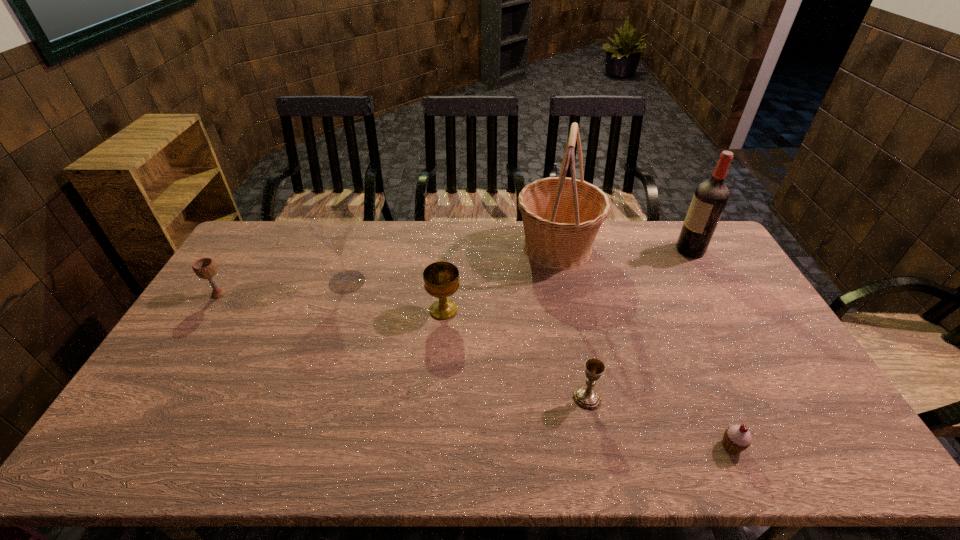
Find the location of `vacant space situated 0.340m on the back of the sixth object from left to right`. vacant space situated 0.340m on the back of the sixth object from left to right is located at coordinates (680, 329).

Locate an element on the screen. Image resolution: width=960 pixels, height=540 pixels. basket situated at the far edge is located at coordinates (561, 216).

What are the coordinates of `liquor that is at the far edge` in the screenshot? It's located at (710, 197).

Find the location of a particular element. object at the near edge is located at coordinates (736, 439).

The height and width of the screenshot is (540, 960). I want to click on object present at the left edge, so click(x=205, y=268).

Identify the location of object that is positioned at the right edge. (710, 197).

You are a GUI agent. You are given a task and a screenshot of the screen. Output one action in this format:
    pyautogui.click(x=<x>, y=<y>)
    Task: Click on the object at the far right corner
    The height and width of the screenshot is (540, 960).
    Given the screenshot: What is the action you would take?
    pyautogui.click(x=710, y=197)

Find the location of `free space at the far edge`. free space at the far edge is located at coordinates (503, 254).

The height and width of the screenshot is (540, 960). I want to click on free region at the near edge, so click(x=679, y=437).

Locate an element on the screen. The image size is (960, 540). free space at the left edge is located at coordinates (156, 396).